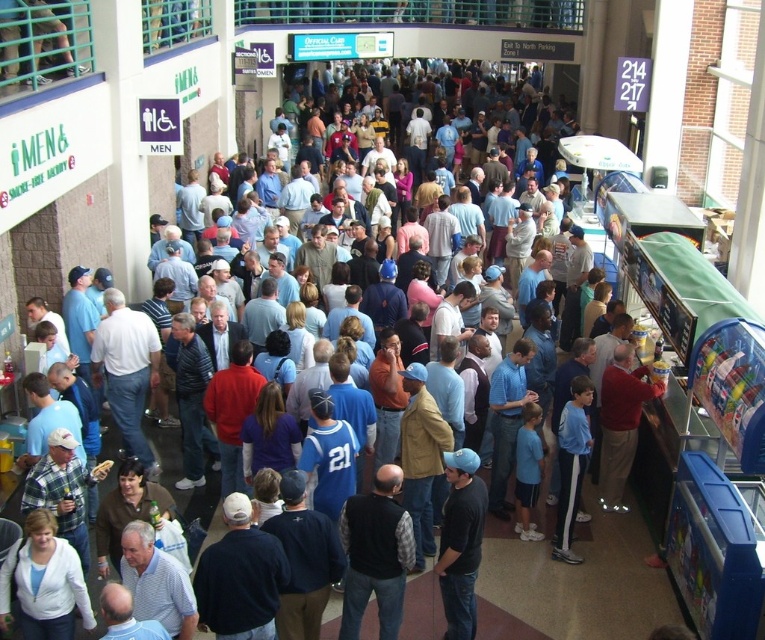
Measure the distance between black vest at center and camera.

They are 7.09 meters apart.

Who is more distant from viewer, [386,586] or [461,588]?

The point [461,588] is more distant.

The width and height of the screenshot is (765, 640). I want to click on black vest at center, so click(x=376, y=554).

Locate an element on the screen. The width and height of the screenshot is (765, 640). black vest at center is located at coordinates [x=376, y=554].